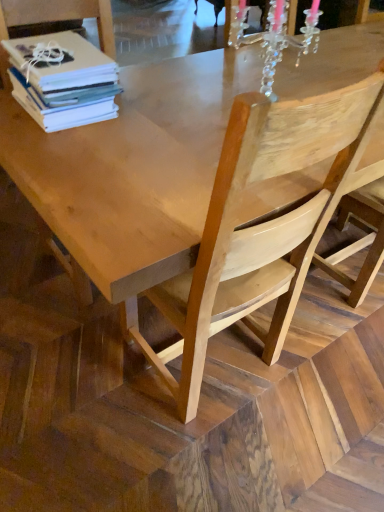
The image size is (384, 512). Find the location of `empty space that is to the right of natural wood chair at center, the second chair when ordered from left to right`. empty space that is to the right of natural wood chair at center, the second chair when ordered from left to right is located at coordinates (322, 376).